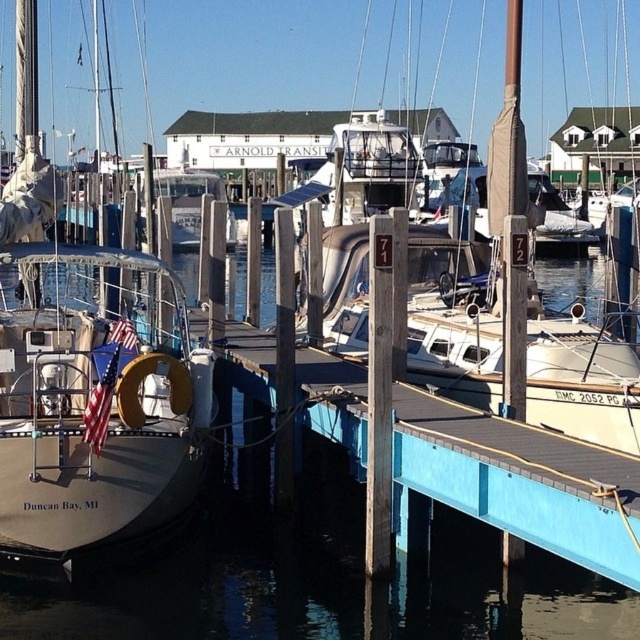
You are a sailor who wants to anchor your boat at the marina. You need to know if the clear water at dock center is deep enough for your boat, which has a draft of 2 meters. The height of the matte white sailboat at left is 10 meters. Can you determine if the water depth at the dock center is sufficient?

The clear water at dock center has a lesser height compared to the matte white sailboat at left, which is 10 meters tall. Since the water height is less than the boat height, the water depth at dock center is likely insufficient for a boat with a 2 meter draft.

You are a sailor trying to navigate your boat through the marina. You see the clear water at dock center and the matte white sailboat at left. Which object is closer to you as you approach the dock?

The clear water at dock center is closer to you because it is in front of the matte white sailboat at left.

Based on the photo, what are the coordinates of the matte white sailboat at left?

The coordinates of the matte white sailboat at left are at point (88, 376).